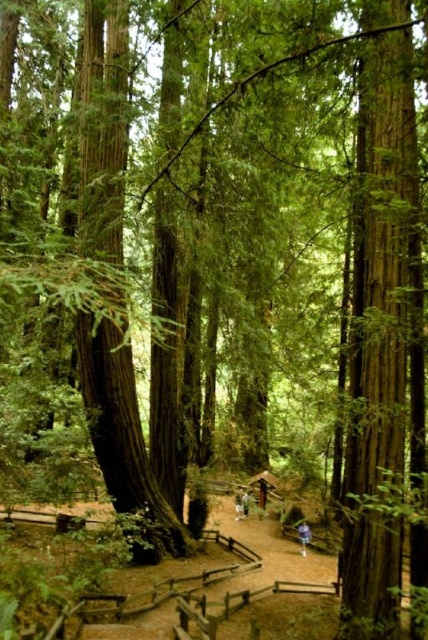
Question: Which object is positioned farthest from the light blue jeans at center?

Choices:
 (A) blue fabric person at center
 (B) light blue denim jeans at center

Answer: (A)

Question: Estimate the real-world distances between objects in this image. Which object is closer to the light blue jeans at center?

Choices:
 (A) light blue denim jeans at center
 (B) blue fabric person at center

Answer: (A)

Question: Where is light blue denim jeans at center located in relation to light blue jeans at center in the image?

Choices:
 (A) left
 (B) right

Answer: (A)

Question: Is blue fabric person at center to the left of light blue denim jeans at center from the viewer's perspective?

Choices:
 (A) no
 (B) yes

Answer: (A)

Question: Which object is farther from the camera taking this photo?

Choices:
 (A) blue fabric person at center
 (B) light blue denim jeans at center

Answer: (B)

Question: From the image, what is the correct spatial relationship of light blue denim jeans at center in relation to light blue jeans at center?

Choices:
 (A) below
 (B) above

Answer: (A)